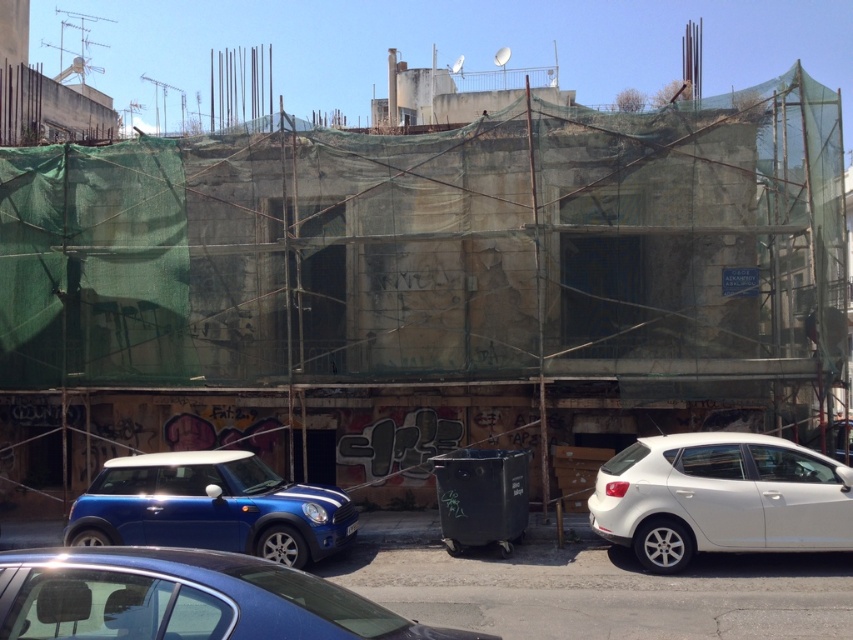
You are driving a car and want to park in the parking lot near the partially constructed building. The parking space you want is next to the shiny blue sedan at lower center. If your car is 4.5 meters long, will it fit in the space?

The distance between your car and the shiny blue sedan at lower center is 4.73 meters. Since your car is 4.5 meters long, it will fit with some space to spare.

You are standing in front of the partially constructed building and want to determine which of the two points, point (70, 552) or point (712, 444), is closer to you. Based on the scene description, which point is nearer?

Point (70, 552) is closer to the viewer than point (712, 444).

You are a pedestrian standing on the sidewalk in front of the partially constructed building. You see a shiny blue sedan at lower center and a shiny blue car at lower left. Which of these vehicles is closer to you?

The shiny blue sedan at lower center is closer to you because it is in front of the shiny blue car at lower left.